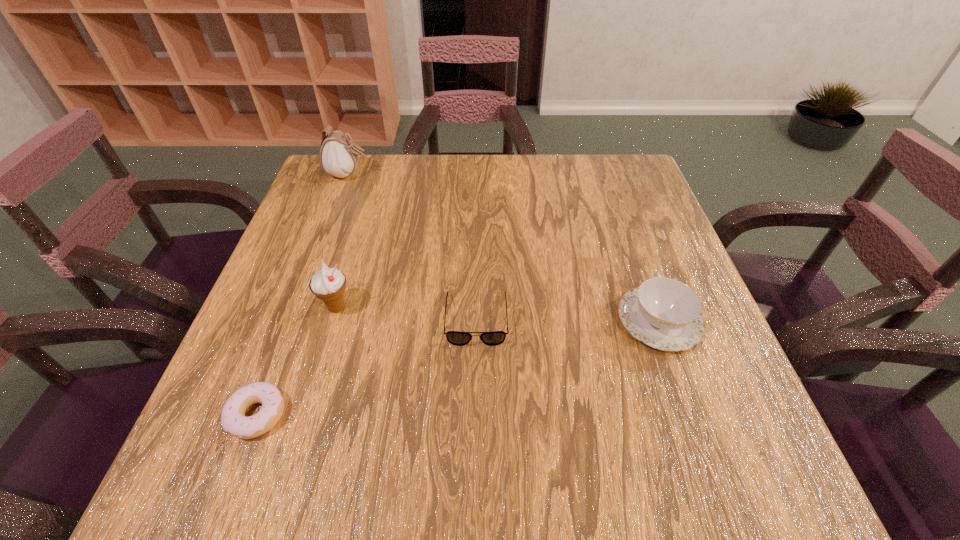
At what (x,y) coordinates should I click in order to perform the action: click on pouch. Please return your answer as a coordinate pair (x, y). The image size is (960, 540). Looking at the image, I should click on (339, 155).

Where is `icecream`? icecream is located at coordinates (328, 284).

You are a GUI agent. You are given a task and a screenshot of the screen. Output one action in this format:
    pyautogui.click(x=<x>, y=<y>)
    Task: Click on the third shortest object
    
    Given the screenshot: What is the action you would take?
    pyautogui.click(x=664, y=313)

I want to click on the rightmost object, so click(x=664, y=313).

Identify the location of the second object from right to left. This screenshot has height=540, width=960. (457, 338).

You are a GUI agent. You are given a task and a screenshot of the screen. Output one action in this format:
    pyautogui.click(x=<x>, y=<y>)
    Task: Click on the shortest object
    This screenshot has height=540, width=960.
    Given the screenshot: What is the action you would take?
    pyautogui.click(x=233, y=419)

This screenshot has height=540, width=960. In order to click on the nearest object in this screenshot , I will do `click(233, 419)`.

At what (x,y) coordinates should I click in order to perform the action: click on blank space located 0.400m on the front-facing side of the pouch. Please return your answer as a coordinate pair (x, y). Looking at the image, I should click on (513, 174).

The image size is (960, 540). I want to click on free region located on the right of the icecream, so click(x=475, y=307).

At what (x,y) coordinates should I click in order to perform the action: click on free location located on the handle side of the rightmost object. Please return your answer as a coordinate pair (x, y). The width and height of the screenshot is (960, 540). Looking at the image, I should click on (614, 193).